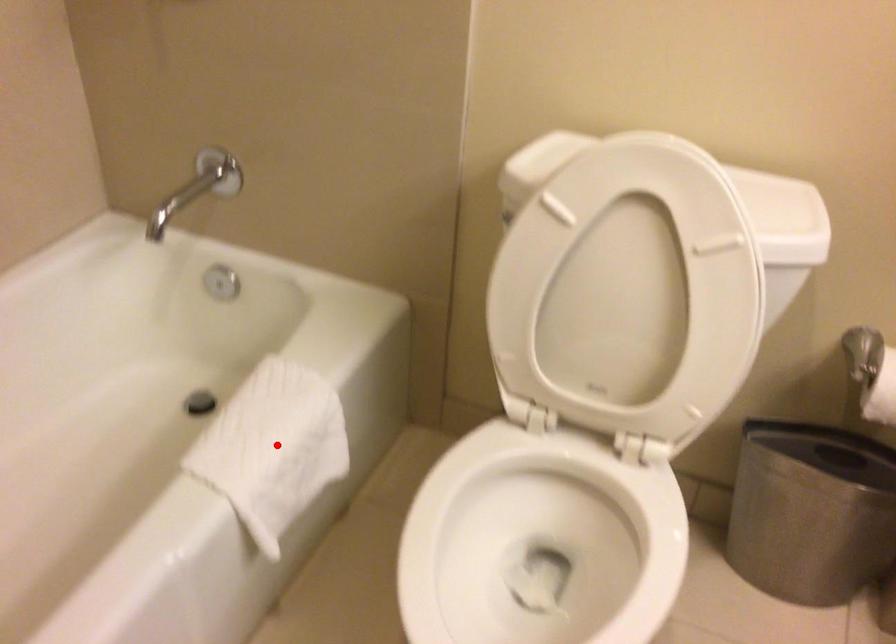
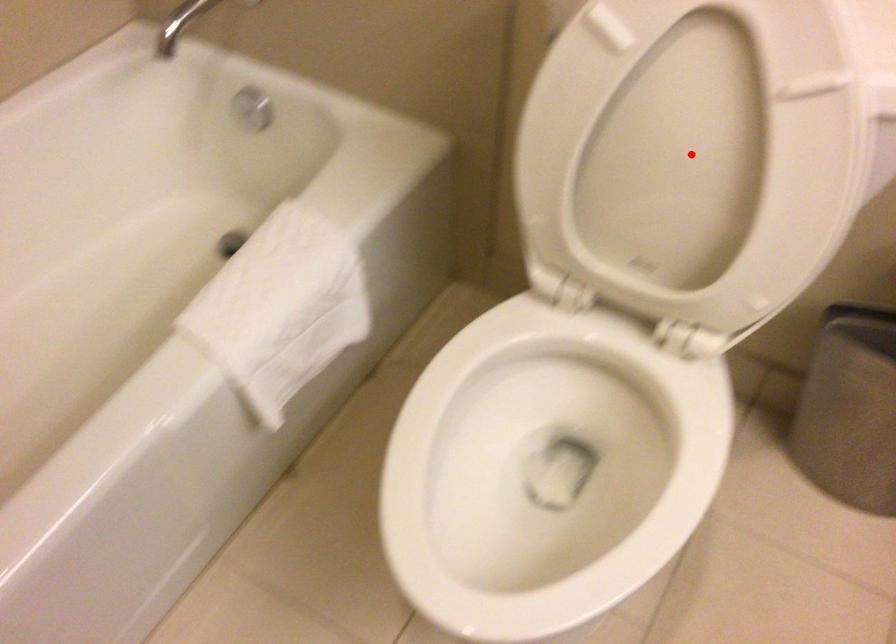
I am providing you with two images of the same scene from different viewpoints. A red point is marked on the first image and another point is marked on the second image. Do the highlighted points in image1 and image2 indicate the same real-world spot?

No